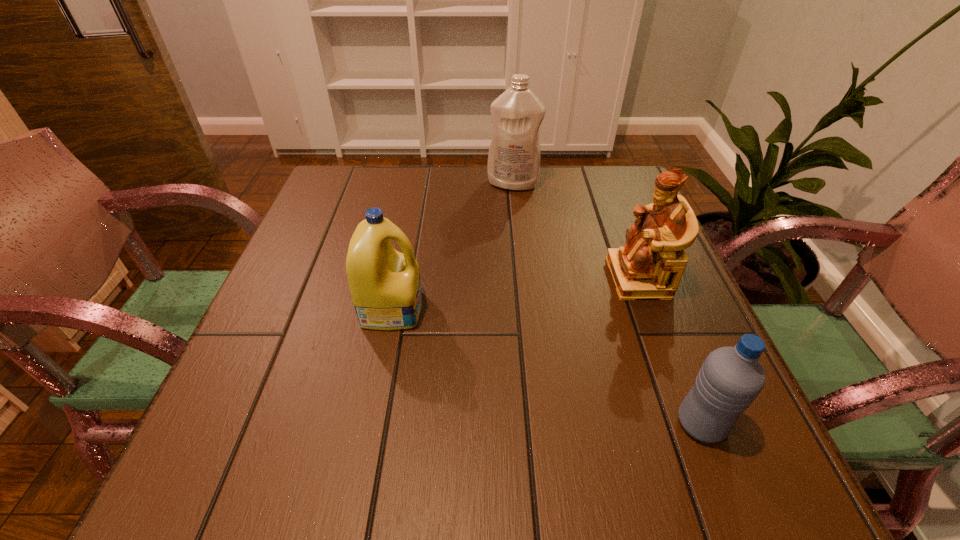
You are a GUI agent. You are given a task and a screenshot of the screen. Output one action in this format:
    pyautogui.click(x=<x>, y=<y>)
    Task: Click on the third object from right to left
    
    Given the screenshot: What is the action you would take?
    pyautogui.click(x=514, y=157)

Identify the location of the farther detergent. The height and width of the screenshot is (540, 960). (514, 157).

Image resolution: width=960 pixels, height=540 pixels. In order to click on figurine in this screenshot , I will do `click(650, 266)`.

Identify the location of the nearer detergent. (385, 286).

Where is `the leftmost object`? This screenshot has width=960, height=540. the leftmost object is located at coordinates (385, 286).

At what (x,y) coordinates should I click in order to perform the action: click on the nearest object. Please return your answer as a coordinate pair (x, y). Looking at the image, I should click on (730, 379).

Where is `vacant area located on the front of the right detergent`? vacant area located on the front of the right detergent is located at coordinates (520, 255).

Find the location of a particular element. The image size is (960, 540). free location located 0.210m on the front-facing side of the figurine is located at coordinates (513, 278).

Find the location of a particular element. This screenshot has height=540, width=960. vacant point located on the front-facing side of the figurine is located at coordinates (569, 278).

Identify the location of vacant region located on the front-facing side of the figurine. (451, 278).